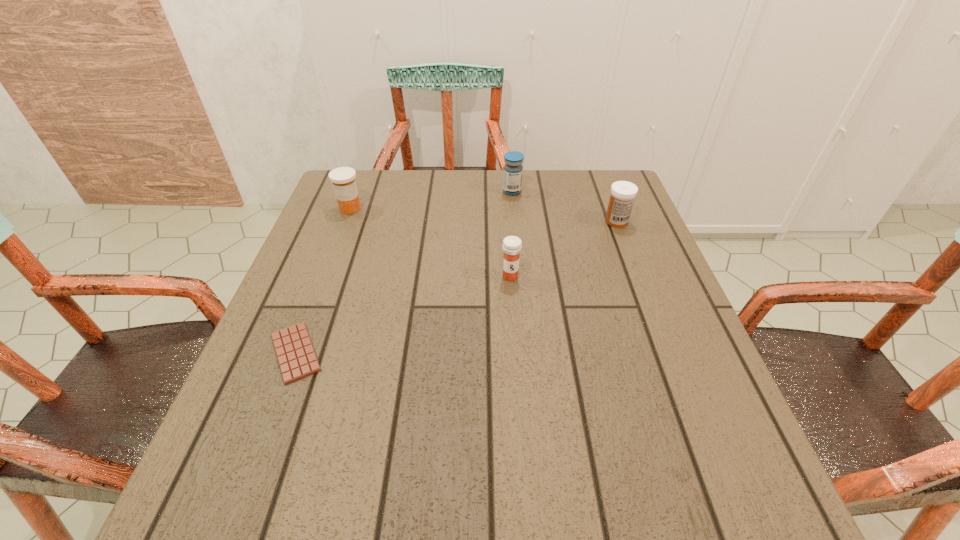
Image resolution: width=960 pixels, height=540 pixels. Identify the location of the farthest medicine. (512, 181).

Locate an element on the screen. the leftmost medicine is located at coordinates (343, 178).

What are the coordinates of `the rightmost object` in the screenshot? It's located at (623, 193).

Image resolution: width=960 pixels, height=540 pixels. Find the location of `the nearest medicine`. the nearest medicine is located at coordinates (512, 245).

Locate an element on the screen. This screenshot has height=540, width=960. the shortest object is located at coordinates (297, 359).

Identify the location of the nearest object. (297, 359).

Find the location of a particular element. vacant region located on the front of the farthest object is located at coordinates (519, 261).

I want to click on free space located 0.160m on the label of the leftmost medicine, so click(x=332, y=255).

I want to click on free spot located 0.070m on the front of the rightmost medicine, so click(x=626, y=246).

Where is `free location located on the label side of the fourth farthest object`? The height and width of the screenshot is (540, 960). free location located on the label side of the fourth farthest object is located at coordinates (519, 407).